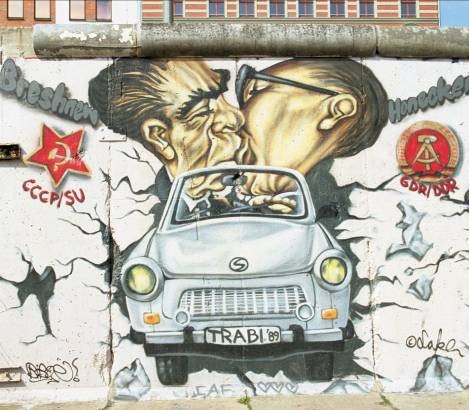
Where is `hood`? hood is located at coordinates (267, 245).